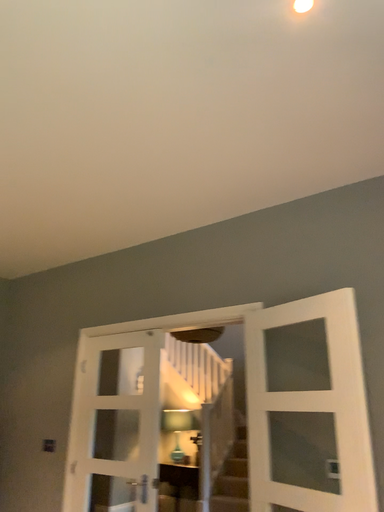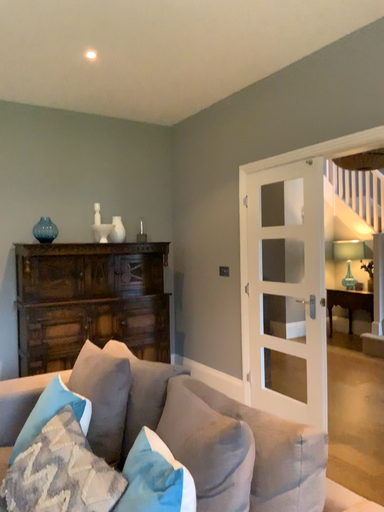
Question: Which way did the camera rotate in the video?

Choices:
 (A) rotated right
 (B) rotated left

Answer: (B)